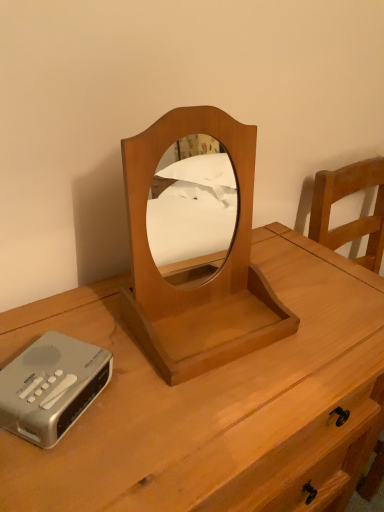
Image resolution: width=384 pixels, height=512 pixels. I want to click on free space between silver metallic cassette at lower left and wooden mirror at center, so click(126, 381).